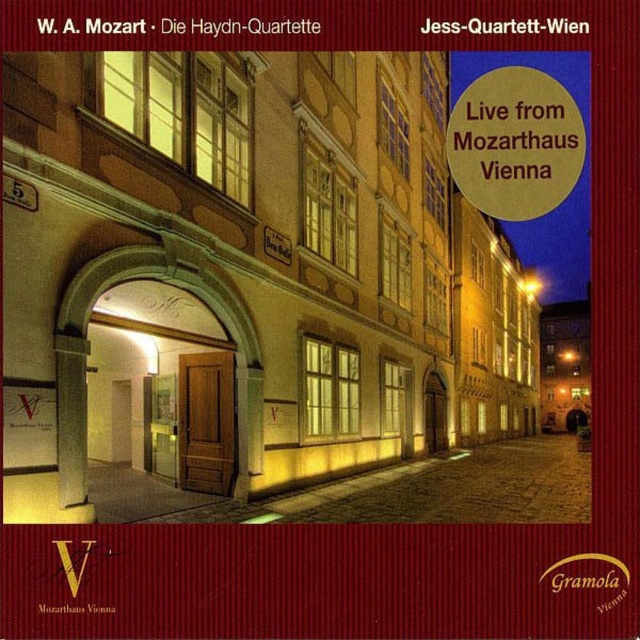
Identify the location of beige stone building at center. This screenshot has height=640, width=640. (243, 278).

Is beige stone building at center shorter than gold metallic circle at upper right?

Correct, beige stone building at center is not as tall as gold metallic circle at upper right.

Does point (369, 316) lie behind point (586, 148)?

Yes, point (369, 316) is behind point (586, 148).

The height and width of the screenshot is (640, 640). I want to click on beige stone building at center, so click(x=243, y=278).